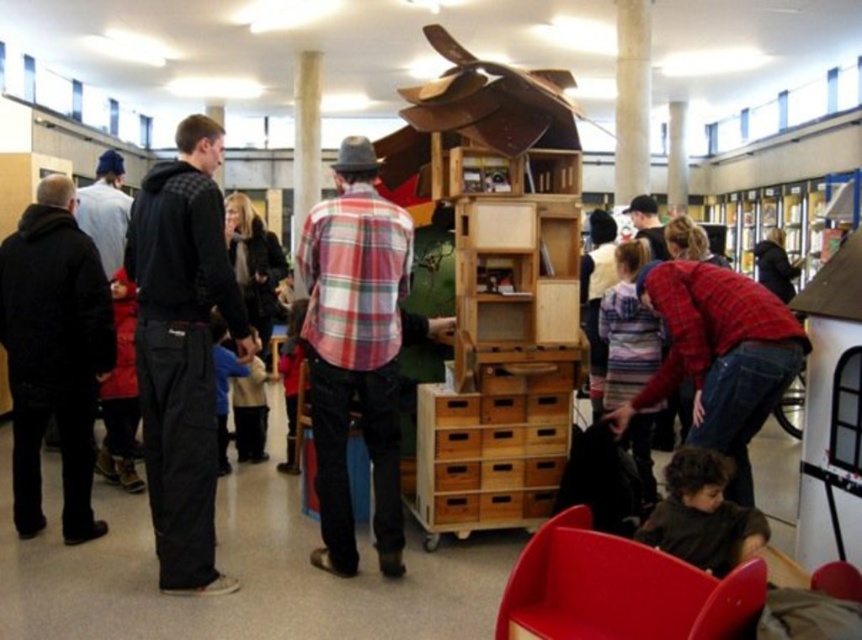
Can you confirm if black matte pants at left is positioned below matte red chair at lower right?

Incorrect, black matte pants at left is not positioned below matte red chair at lower right.

Is black matte pants at left smaller than matte red chair at lower right?

Actually, black matte pants at left might be larger than matte red chair at lower right.

You are a GUI agent. You are given a task and a screenshot of the screen. Output one action in this format:
    pyautogui.click(x=<x>, y=<y>)
    Task: Click on the black matte pants at left
    The height and width of the screenshot is (640, 862).
    Given the screenshot: What is the action you would take?
    pyautogui.click(x=182, y=348)

Which is above, black matte pants at left or black matte jacket at left?

black matte pants at left is above.

The image size is (862, 640). What are the coordinates of `black matte pants at left` in the screenshot? It's located at (182, 348).

Which is in front, point (166, 525) or point (41, 440)?

Point (166, 525) is more forward.

Locate an element on the screen. The width and height of the screenshot is (862, 640). black matte pants at left is located at coordinates (182, 348).

Identify the location of plaid fabric shirt at center. (355, 352).

Who is more distant from viewer, (332, 340) or (92, 358)?

Point (92, 358)

Where is `plaid fabric shirt at center`? plaid fabric shirt at center is located at coordinates (355, 352).